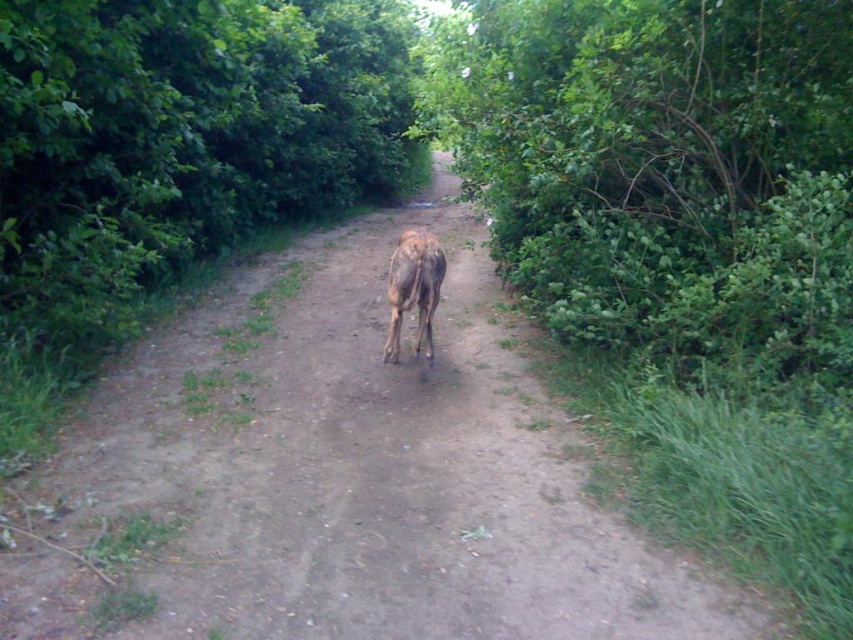
You are a hiker standing at point (415, 260) and want to reach the cow in the center of the path. Which direction should you move relative to the cow located at point (373, 502)?

You should move towards the point (373, 502) because it is in front of the cow located at (415, 260), so moving in that direction will lead you closer to the cow.

You are standing at the point marked by the coordinates point [184,131] in this rural scene. Looking around, you see a cow in the center of the dirt path. Which direction should you walk to reach the cow?

The point [184,131] corresponds to the green leafy tree at center. Since the cow is also in the center of the dirt path, you should walk towards the direction of the cow from the green leafy tree at center.